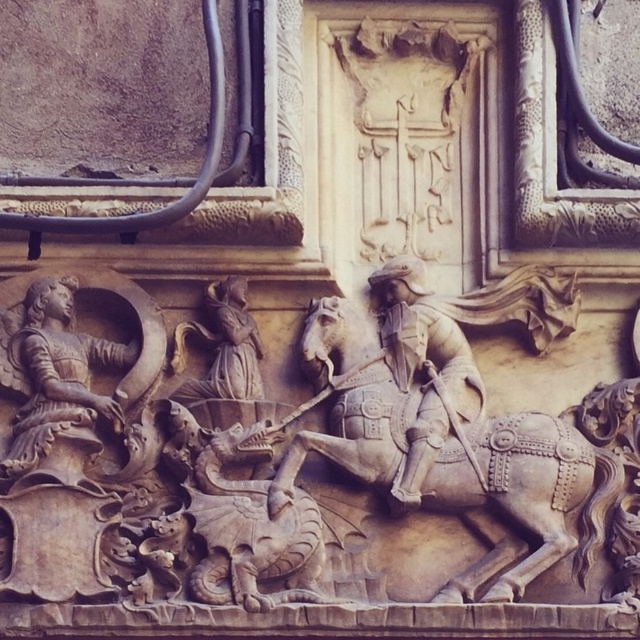
Based on the scene described, which object is closer to the viewer between the stone dragon at center and the stone figure at center?

The stone dragon at center is closer to the viewer than the stone figure at center because it is positioned in front of it.

In the stone relief sculpture depicting a knight battling a dragon, where is the stone dragon at center located relative to the stone figure at center?

The stone dragon at center is to the right of the stone figure at center.